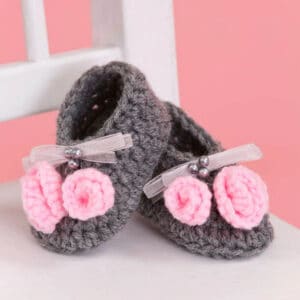
Locate an element on the screen. white chair base is located at coordinates (126, 283).